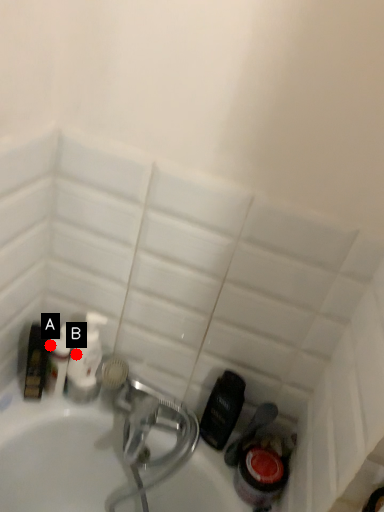
Question: Two points are circled on the image, labeled by A and B beside each circle. Which point is farther to the camera?

Choices:
 (A) A is further
 (B) B is further

Answer: (B)